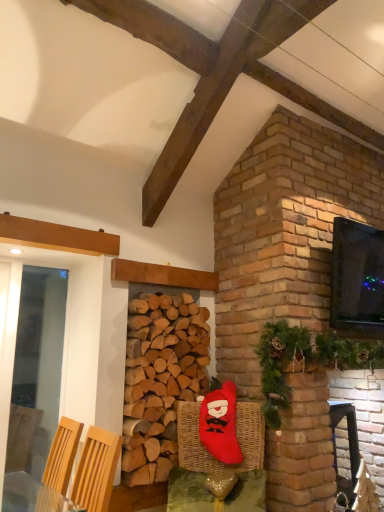
Question: Is natural brown wood at center closer to camera compared to woven wicker basket at lower center?

Choices:
 (A) yes
 (B) no

Answer: (B)

Question: From the image's perspective, is natural brown wood at center below woven wicker basket at lower center?

Choices:
 (A) yes
 (B) no

Answer: (B)

Question: Does natural brown wood at center have a lesser width compared to woven wicker basket at lower center?

Choices:
 (A) yes
 (B) no

Answer: (B)

Question: Does natural brown wood at center turn towards woven wicker basket at lower center?

Choices:
 (A) no
 (B) yes

Answer: (B)

Question: Can we say natural brown wood at center lies outside woven wicker basket at lower center?

Choices:
 (A) no
 (B) yes

Answer: (B)

Question: Based on their sizes in the image, would you say natural brown wood at center is bigger or smaller than red plush santa at center?

Choices:
 (A) big
 (B) small

Answer: (A)

Question: Would you say natural brown wood at center is to the left or to the right of red plush santa at center in the picture?

Choices:
 (A) right
 (B) left

Answer: (B)

Question: From the image's perspective, is natural brown wood at center located above or below red plush santa at center?

Choices:
 (A) above
 (B) below

Answer: (A)

Question: Is natural brown wood at center wider or thinner than red plush santa at center?

Choices:
 (A) thin
 (B) wide

Answer: (B)

Question: Is natural brown wood at center taller or shorter than green textured garland at upper right?

Choices:
 (A) tall
 (B) short

Answer: (A)

Question: In the image, is natural brown wood at center on the left side or the right side of green textured garland at upper right?

Choices:
 (A) right
 (B) left

Answer: (B)

Question: Which is correct: natural brown wood at center is inside green textured garland at upper right, or outside of it?

Choices:
 (A) inside
 (B) outside

Answer: (B)

Question: Is natural brown wood at center wider or thinner than green textured garland at upper right?

Choices:
 (A) wide
 (B) thin

Answer: (B)

Question: In terms of width, does black glossy tv at upper right look wider or thinner when compared to light wood armchair at lower left, arranged as the 1th armchair when viewed from the left?

Choices:
 (A) thin
 (B) wide

Answer: (A)

Question: Is black glossy tv at upper right bigger or smaller than light wood armchair at lower left, arranged as the first armchair when viewed from the front?

Choices:
 (A) small
 (B) big

Answer: (B)